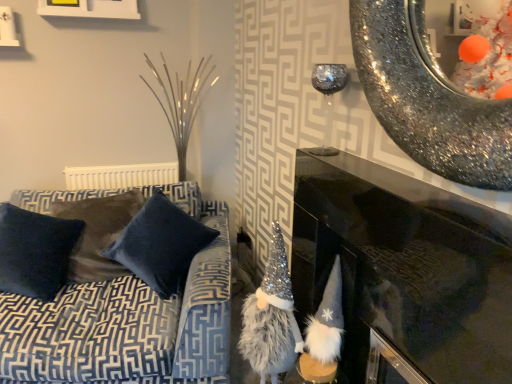
Question: From the image's perspective, is black glossy fireplace at center located beneath velvet blue pillow at center, which is the 2th pillow from left to right?

Choices:
 (A) yes
 (B) no

Answer: (A)

Question: Is black glossy fireplace at center bigger than velvet blue pillow at center, which is the 2th pillow from left to right?

Choices:
 (A) no
 (B) yes

Answer: (B)

Question: Is black glossy fireplace at center positioned in front of velvet blue pillow at center, which is the 2th pillow from left to right?

Choices:
 (A) no
 (B) yes

Answer: (B)

Question: Is black glossy fireplace at center completely or partially outside of velvet blue pillow at center, which is the 2th pillow from left to right?

Choices:
 (A) no
 (B) yes

Answer: (B)

Question: Is black glossy fireplace at center smaller than velvet blue pillow at center, which is the 2th pillow from left to right?

Choices:
 (A) yes
 (B) no

Answer: (B)

Question: From a real-world perspective, is white matte picture frame at upper left above or below fuzzy silver gnome at center?

Choices:
 (A) below
 (B) above

Answer: (B)

Question: Based on their positions, is white matte picture frame at upper left located to the left or right of fuzzy silver gnome at center?

Choices:
 (A) left
 (B) right

Answer: (A)

Question: In terms of size, does white matte picture frame at upper left appear bigger or smaller than fuzzy silver gnome at center?

Choices:
 (A) small
 (B) big

Answer: (A)

Question: Is white matte picture frame at upper left inside or outside of fuzzy silver gnome at center?

Choices:
 (A) inside
 (B) outside

Answer: (B)

Question: Would you say velvet blue pillow at center, which is the 2th pillow from left to right, is inside or outside velvet blue couch at left?

Choices:
 (A) inside
 (B) outside

Answer: (A)

Question: Considering the positions of velvet blue pillow at center, the 1th pillow positioned from the right, and velvet blue couch at left in the image, is velvet blue pillow at center, the 1th pillow positioned from the right, bigger or smaller than velvet blue couch at left?

Choices:
 (A) big
 (B) small

Answer: (B)

Question: In terms of height, does velvet blue pillow at center, the 1th pillow positioned from the right, look taller or shorter compared to velvet blue couch at left?

Choices:
 (A) short
 (B) tall

Answer: (A)

Question: In the image, is velvet blue pillow at center, the 1th pillow positioned from the right, positioned in front of or behind velvet blue couch at left?

Choices:
 (A) behind
 (B) front

Answer: (A)

Question: Is velvet dark blue pillow at left, the first pillow in the left-to-right sequence, taller or shorter than white matte picture frame at upper left?

Choices:
 (A) short
 (B) tall

Answer: (B)

Question: Visually, is velvet dark blue pillow at left, the 2th pillow when ordered from right to left, positioned to the left or to the right of white matte picture frame at upper left?

Choices:
 (A) left
 (B) right

Answer: (A)